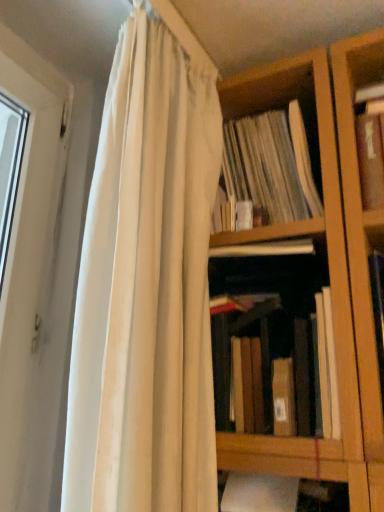
Consider the image. In order to face white cotton curtain at upper left, should I rotate leftwards or rightwards?

You should rotate left by 2.821 degrees.

This screenshot has height=512, width=384. What do you see at coordinates (146, 289) in the screenshot?
I see `white cotton curtain at upper left` at bounding box center [146, 289].

Identify the location of white cotton curtain at upper left. (146, 289).

I want to click on brown matte book at center, so click(x=237, y=371).

Image resolution: width=384 pixels, height=512 pixels. What do you see at coordinates (237, 371) in the screenshot? I see `brown matte book at center` at bounding box center [237, 371].

From the picture: Measure the distance between point (x=251, y=372) and camera.

Point (x=251, y=372) is 31.93 inches away from camera.

At what (x,y) coordinates should I click in order to perform the action: click on white cotton curtain at upper left. Please return your answer as a coordinate pair (x, y). Looking at the image, I should click on (146, 289).

Which is more to the left, brown matte book at center or white cotton curtain at upper left?

white cotton curtain at upper left is more to the left.

Is brown matte book at center positioned behind white cotton curtain at upper left?

Yes, the depth of brown matte book at center is greater than that of white cotton curtain at upper left.

Considering the points (220, 330) and (192, 77), which point is behind, point (220, 330) or point (192, 77)?

Point (192, 77)

From the image's perspective, does brown matte book at center appear lower than white cotton curtain at upper left?

Yes, from the image's perspective, brown matte book at center is below white cotton curtain at upper left.

From a real-world perspective, is brown matte book at center below white cotton curtain at upper left?

Correct, in the physical world, brown matte book at center is lower than white cotton curtain at upper left.

Which of these two, brown matte book at center or white cotton curtain at upper left, is thinner?

With smaller width is white cotton curtain at upper left.

Considering the sizes of objects brown matte book at center and white cotton curtain at upper left in the image provided, who is shorter, brown matte book at center or white cotton curtain at upper left?

With less height is brown matte book at center.

Which of these two, brown matte book at center or white cotton curtain at upper left, is bigger?

white cotton curtain at upper left is bigger.

Choose the correct answer: Is brown matte book at center inside white cotton curtain at upper left or outside it?

brown matte book at center is located beyond the bounds of white cotton curtain at upper left.

Is brown matte book at center touching white cotton curtain at upper left?

No, brown matte book at center is not touching white cotton curtain at upper left.

Does brown matte book at center turn towards white cotton curtain at upper left?

Yes, brown matte book at center is turned towards white cotton curtain at upper left.

At what (x,y) coordinates should I click in order to perform the action: click on book on the right of white cotton curtain at upper left. Please return your answer as a coordinate pair (x, y). Looking at the image, I should click on (237, 371).

Based on their positions, is white cotton curtain at upper left located to the left or right of brown matte book at center?

Based on their positions, white cotton curtain at upper left is located to the left of brown matte book at center.

Relative to brown matte book at center, is white cotton curtain at upper left in front or behind?

In the image, white cotton curtain at upper left appears in front of brown matte book at center.

Considering the positions of point (160, 337) and point (259, 421), is point (160, 337) closer or farther from the camera than point (259, 421)?

Point (160, 337) appears to be closer to the viewer than point (259, 421).

From the image's perspective, which is above, white cotton curtain at upper left or brown matte book at center?

white cotton curtain at upper left is shown above in the image.

From a real-world perspective, which object stands above the other?

white cotton curtain at upper left is physically above.

Can you confirm if white cotton curtain at upper left is wider than brown matte book at center?

Incorrect, the width of white cotton curtain at upper left does not surpass that of brown matte book at center.

From their relative heights in the image, would you say white cotton curtain at upper left is taller or shorter than brown matte book at center?

In the image, white cotton curtain at upper left appears to be taller than brown matte book at center.

Is white cotton curtain at upper left bigger than brown matte book at center?

Yes.

Is white cotton curtain at upper left spatially inside brown matte book at center, or outside of it?

white cotton curtain at upper left is outside brown matte book at center.

Can you see white cotton curtain at upper left touching brown matte book at center?

white cotton curtain at upper left and brown matte book at center are not in contact.

Is white cotton curtain at upper left facing towards brown matte book at center?

No, white cotton curtain at upper left is not facing towards brown matte book at center.

Can you tell me how much white cotton curtain at upper left and brown matte book at center differ in facing direction?

The facing directions of white cotton curtain at upper left and brown matte book at center are 89.9 degrees apart.

At what (x,y) coordinates should I click in order to perform the action: click on book directly beneath the white cotton curtain at upper left (from a real-world perspective). Please return your answer as a coordinate pair (x, y). Looking at the image, I should click on (237, 371).

Locate an element on the screen. Image resolution: width=384 pixels, height=512 pixels. book below the white cotton curtain at upper left (from the image's perspective) is located at coordinates (237, 371).

Image resolution: width=384 pixels, height=512 pixels. I want to click on curtain above the brown matte book at center (from a real-world perspective), so click(146, 289).